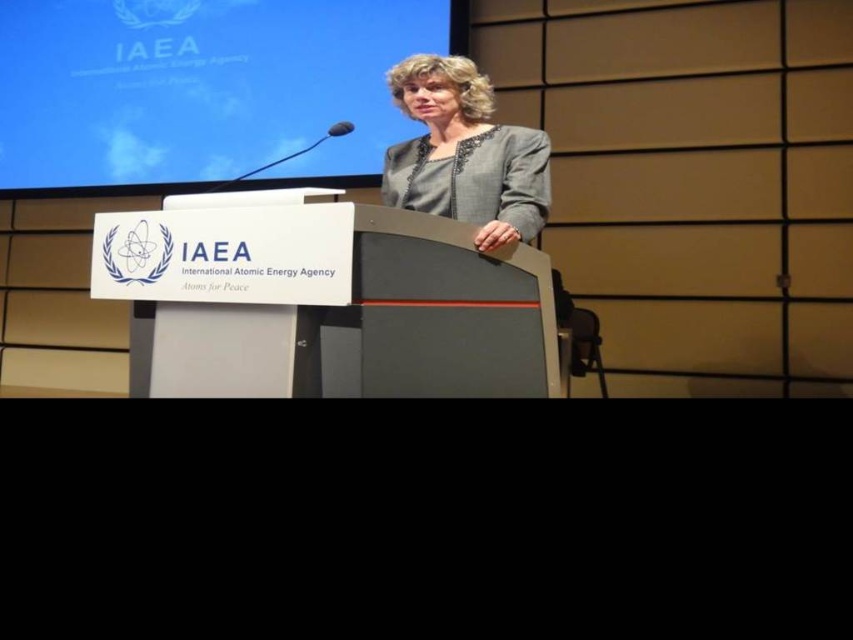
How far apart are white plastic podium at center and gray fabric jacket at center?

white plastic podium at center and gray fabric jacket at center are 16.58 inches apart.

Who is more forward, (421, 252) or (448, 147)?

Point (421, 252)

Find the location of a particular element. white plastic podium at center is located at coordinates (368, 326).

Is blue glossy screen at upper center taller than white plastic podium at center?

Indeed, blue glossy screen at upper center has a greater height compared to white plastic podium at center.

Is point (108, 120) more distant than point (285, 390)?

Yes, it is behind point (285, 390).

Locate an element on the screen. blue glossy screen at upper center is located at coordinates (201, 84).

Which is more to the left, blue glossy screen at upper center or gray fabric jacket at center?

blue glossy screen at upper center is more to the left.

I want to click on blue glossy screen at upper center, so click(201, 84).